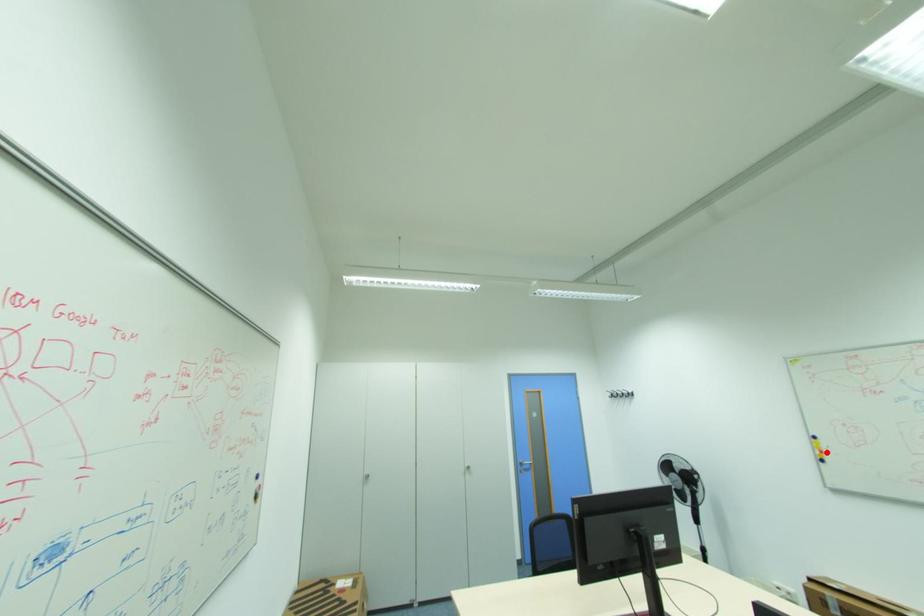
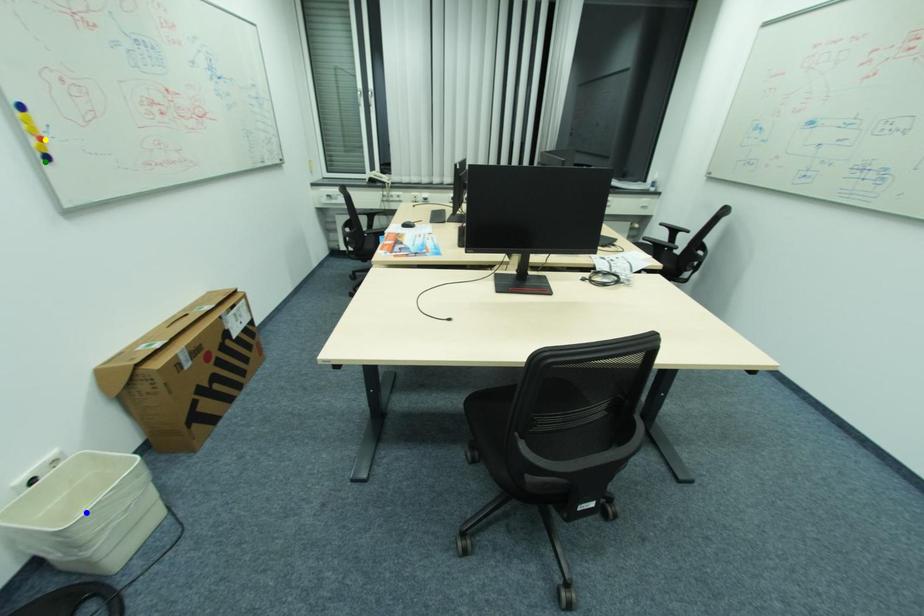
Question: I am providing you with two images of the same scene from different viewpoints. A red point is marked on the first image. You are given multiple points on the second image. In image 2, which mark is for the same physical point as the one in image 1?

Choices:
 (A) yellow point
 (B) blue point
 (C) green point

Answer: (A)